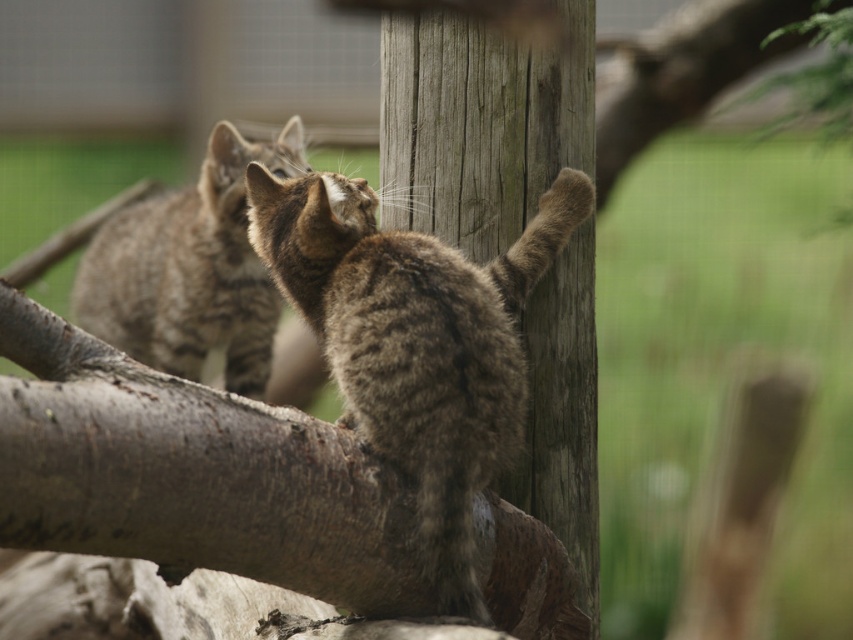
You are a zookeeper observing the cats in their enclosure. The brown fur cat at center is your focus. If you want to place a treat between them, how far apart should you position the treat from each cat to ensure it is equidistant?

The treat should be placed exactly halfway between the two cats, which are 8.72 feet apart. This means the treat should be 4.36 feet away from each cat.

You are a zookeeper observing the cats in their enclosure. You need to place a feeding tray exactly at the center point of the enclosure, which is at coordinates 0.5, 0.5. Is the brown fur cat at center currently positioned near the feeding tray location?

The brown fur cat at center is located at point (415,340), which is very close to the center coordinates (426,320). Therefore, the brown fur cat at center is near the feeding tray location.